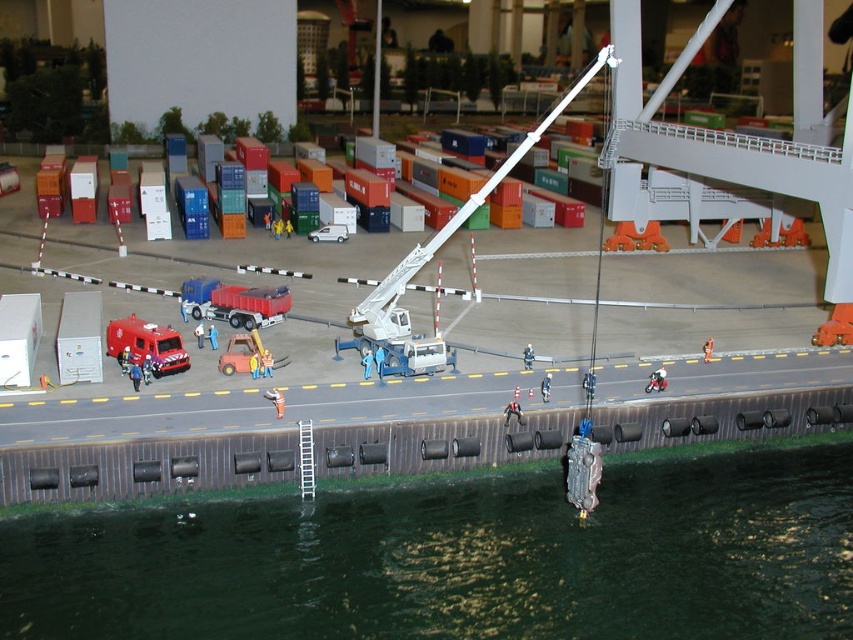
You are a small toy repair technician who just arrived at the miniature port scene. You see an orange fabric toy at center and a metallic silver crane at center. Which object is closer to the ground?

The orange fabric toy at center is located below metallic silver crane at center, so it is closer to the ground.

You are a miniature figure standing on the paved area in the middle of the scene. You need to cross the dark green water in the foreground to reach the crane on the right. Which object, the orange rubber boat at center or the metallic silver motorcycle at center, would be more suitable for crossing the water?

The orange rubber boat at center is more suitable for crossing the dark green water in the foreground because it is a watercraft and has a larger size compared to the metallic silver motorcycle at center, which is a land vehicle and cannot float.

You are a toy collector who wants to place a new orange fabric toy at center and a metallic silver crane at center in your miniature port scene. Given their sizes, which object will occupy more space in the layout?

The orange fabric toy at center has a larger size compared to the metallic silver crane at center, so it will occupy more space in the layout.